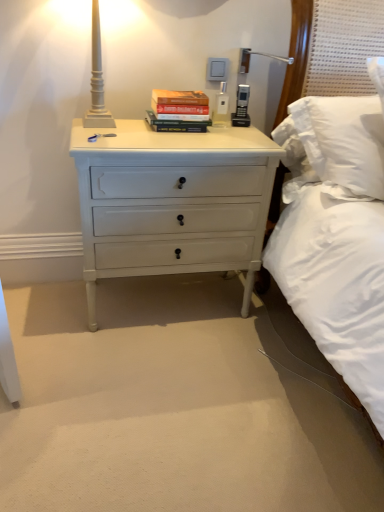
Identify the location of free location in front of white matte lamp at upper left. (112, 139).